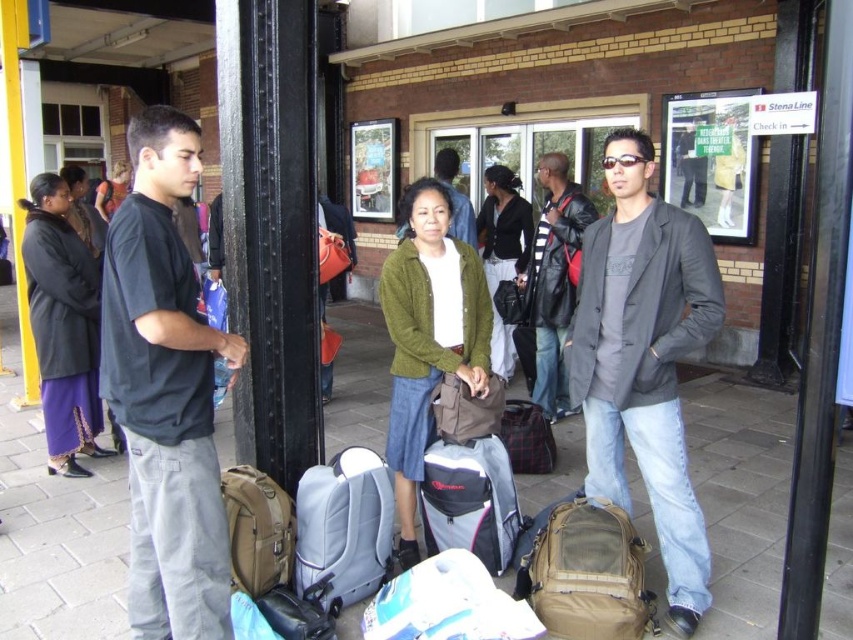
Question: Which object is farther from the camera taking this photo?

Choices:
 (A) black cotton t-shirt at left
 (B) leather backpack at center
 (C) dark gray blazer at center
 (D) gray fabric backpack at center

Answer: (D)

Question: Can you confirm if brown fabric bag at center is smaller than orange fabric bag at center?

Choices:
 (A) no
 (B) yes

Answer: (B)

Question: Which of the following is the farthest from the observer?

Choices:
 (A) brown fabric bag at center
 (B) dark gray jacket at center
 (C) orange fabric bag at center

Answer: (B)

Question: Is black cotton t-shirt at left below tan fabric backpack at lower right?

Choices:
 (A) no
 (B) yes

Answer: (A)

Question: Which point is closer to the camera?

Choices:
 (A) (386, 628)
 (B) (325, 352)
 (C) (538, 333)
 (D) (492, 557)

Answer: (A)

Question: Can you confirm if brown fabric bag at center is positioned to the right of orange fabric bag at center?

Choices:
 (A) no
 (B) yes

Answer: (B)